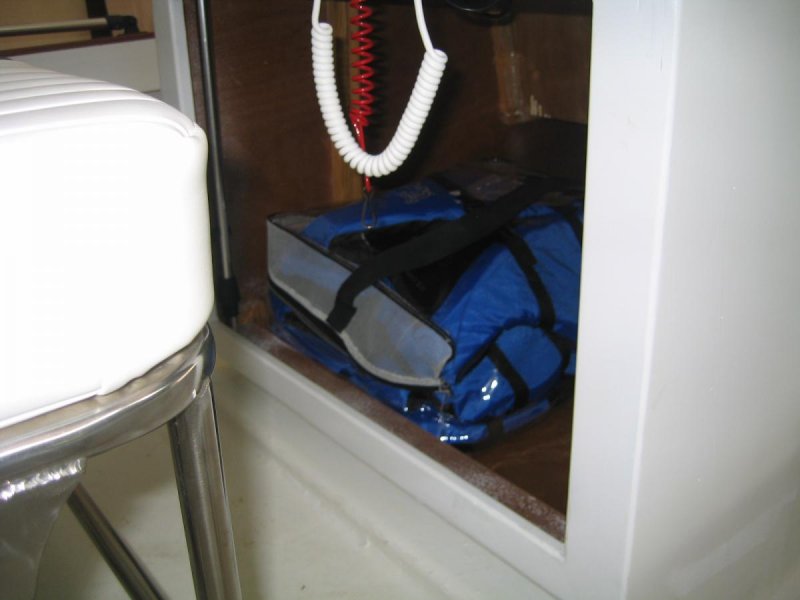
This screenshot has height=600, width=800. What are the coordinates of `metal rod inside cupboard` in the screenshot? It's located at (206, 64).